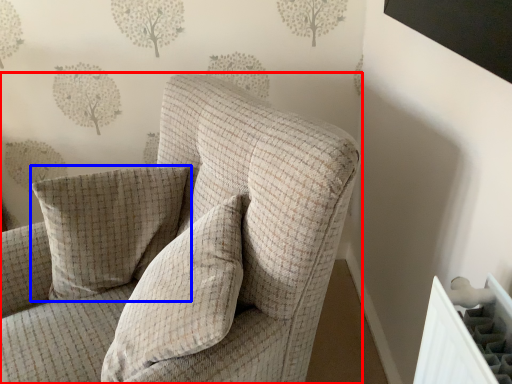
Question: Which of the following is the closest to the observer, chair (highlighted by a red box) or pillow (highlighted by a blue box)?

Choices:
 (A) chair
 (B) pillow

Answer: (A)